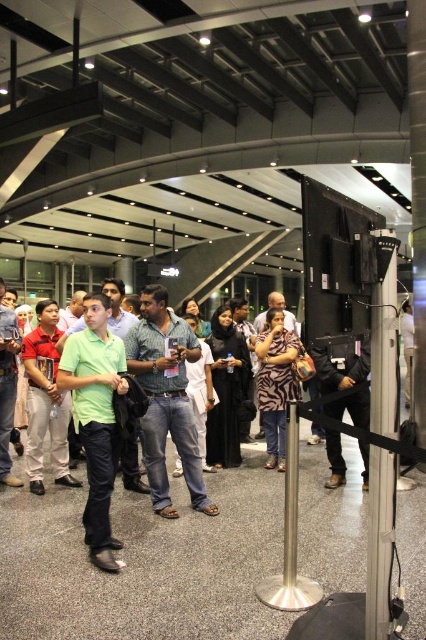
Which is more to the left, metallic pole at center or light green shirt at center?

light green shirt at center is more to the left.

This screenshot has width=426, height=640. What do you see at coordinates (382, 444) in the screenshot?
I see `metallic pole at center` at bounding box center [382, 444].

You are a GUI agent. You are given a task and a screenshot of the screen. Output one action in this format:
    pyautogui.click(x=<x>, y=<y>)
    Task: Click on the metallic pole at center
    This screenshot has width=426, height=640.
    Given the screenshot: What is the action you would take?
    pyautogui.click(x=382, y=444)

Can you confirm if denim jeans at center is wider than green matte shirt at center?

Indeed, denim jeans at center has a greater width compared to green matte shirt at center.

Is point (166, 404) more distant than point (77, 356)?

Yes, point (166, 404) is behind point (77, 356).

You are a GUI agent. You are given a task and a screenshot of the screen. Output one action in this format:
    pyautogui.click(x=<x>, y=<y>)
    Task: Click on the denim jeans at center
    
    Given the screenshot: What is the action you would take?
    pyautogui.click(x=166, y=397)

Which is above, metallic pole at center or zebra print shirt at center?

Positioned higher is zebra print shirt at center.

Looking at this image, is metallic pole at center further to the viewer compared to zebra print shirt at center?

No.

The image size is (426, 640). What are the coordinates of `metallic pole at center` in the screenshot? It's located at (382, 444).

At what (x,y) coordinates should I click in order to perform the action: click on metallic pole at center. Please return your answer as a coordinate pair (x, y). The width and height of the screenshot is (426, 640). Looking at the image, I should click on (382, 444).